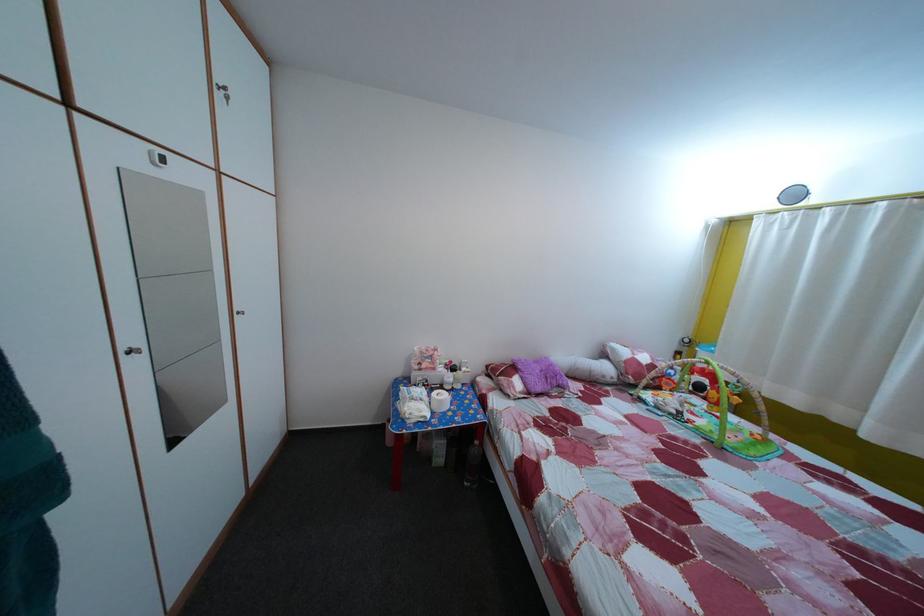
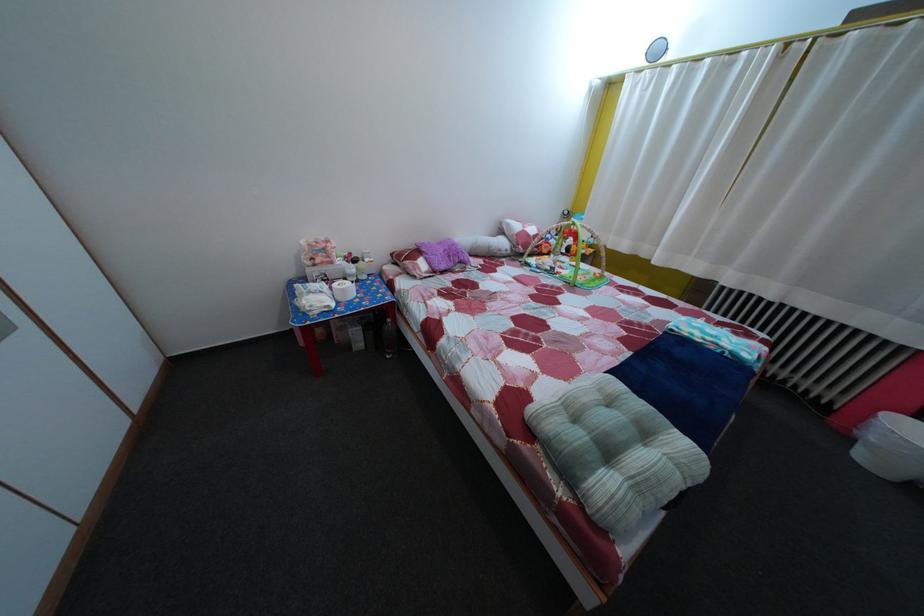
What movement of the cameraman would produce the second image?

The cameraman moved toward right, backward.